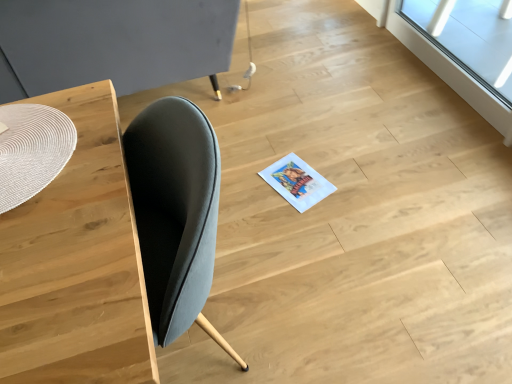
Question: Does wooden table at left appear on the left side of matte woven placemat at left, the first round table when ordered from back to front?

Choices:
 (A) yes
 (B) no

Answer: (B)

Question: Can you confirm if wooden table at left is wider than matte woven placemat at left, arranged as the 2th round table when viewed from the front?

Choices:
 (A) yes
 (B) no

Answer: (B)

Question: Is wooden table at left aimed at matte woven placemat at left, arranged as the 2th round table when viewed from the front?

Choices:
 (A) no
 (B) yes

Answer: (B)

Question: Does wooden table at left have a lesser height compared to matte woven placemat at left, the 2th round table positioned from the bottom?

Choices:
 (A) no
 (B) yes

Answer: (A)

Question: Considering the relative positions of wooden table at left and matte woven placemat at left, which is the 1th round table in top-to-bottom order, in the image provided, is wooden table at left in front of matte woven placemat at left, which is the 1th round table in top-to-bottom order,?

Choices:
 (A) yes
 (B) no

Answer: (A)

Question: From a real-world perspective, relative to white woven placemat at left, which appears as the 1th round table when ordered from the bottom, is matte woven placemat at left, which is the 1th round table in top-to-bottom order, vertically above or below?

Choices:
 (A) below
 (B) above

Answer: (A)

Question: Do you think matte woven placemat at left, the 2th round table positioned from the bottom, is within white woven placemat at left, the second round table in the back-to-front sequence, or outside of it?

Choices:
 (A) outside
 (B) inside

Answer: (A)

Question: Considering the positions of point (39, 6) and point (61, 142), is point (39, 6) closer or farther from the camera than point (61, 142)?

Choices:
 (A) closer
 (B) farther

Answer: (B)

Question: Considering the positions of matte woven placemat at left, which is the 1th round table in top-to-bottom order, and white woven placemat at left, the second round table in the back-to-front sequence, in the image, is matte woven placemat at left, which is the 1th round table in top-to-bottom order, wider or thinner than white woven placemat at left, the second round table in the back-to-front sequence,?

Choices:
 (A) thin
 (B) wide

Answer: (B)

Question: In terms of width, does matte woven placemat at left, arranged as the 2th round table when viewed from the front, look wider or thinner when compared to wooden table at left?

Choices:
 (A) thin
 (B) wide

Answer: (B)

Question: Is point [27, 31] positioned closer to the camera than point [116, 357]?

Choices:
 (A) closer
 (B) farther

Answer: (B)

Question: In the image, is matte woven placemat at left, the 2th round table positioned from the bottom, positioned in front of or behind wooden table at left?

Choices:
 (A) front
 (B) behind

Answer: (B)

Question: Would you say matte woven placemat at left, the 2th round table positioned from the bottom, is inside or outside wooden table at left?

Choices:
 (A) inside
 (B) outside

Answer: (B)

Question: Based on their sizes in the image, would you say matte woven placemat at left, arranged as the 2th round table when viewed from the front, is bigger or smaller than transparent glass window at upper right?

Choices:
 (A) big
 (B) small

Answer: (A)

Question: From a real-world perspective, relative to transparent glass window at upper right, is matte woven placemat at left, which is the 1th round table in top-to-bottom order, vertically above or below?

Choices:
 (A) above
 (B) below

Answer: (A)